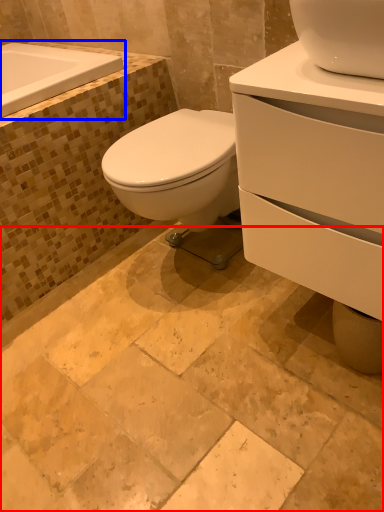
Question: Which of the following is the closest to the observer, ceramic tile (highlighted by a red box) or bath (highlighted by a blue box)?

Choices:
 (A) ceramic tile
 (B) bath

Answer: (A)